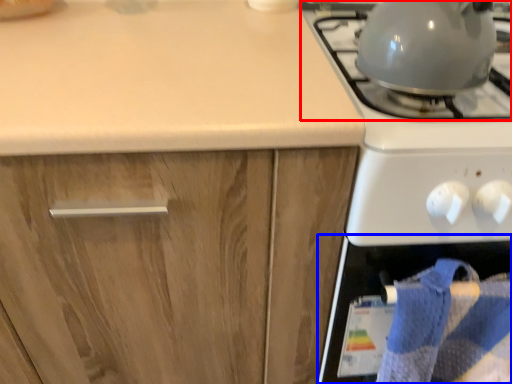
Question: Which object appears closest to the camera in this image, gas stove (highlighted by a red box) or oven (highlighted by a blue box)?

Choices:
 (A) gas stove
 (B) oven

Answer: (A)